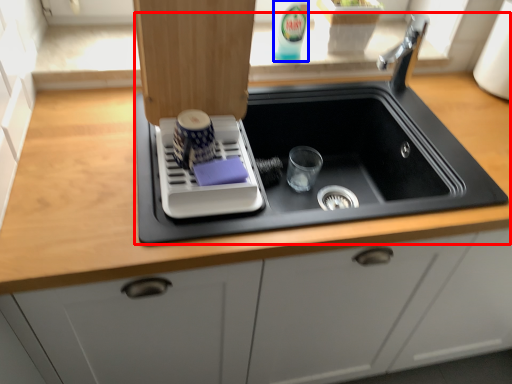
Question: Which object appears farthest to the camera in this image, sink (highlighted by a red box) or beverage (highlighted by a blue box)?

Choices:
 (A) sink
 (B) beverage

Answer: (B)